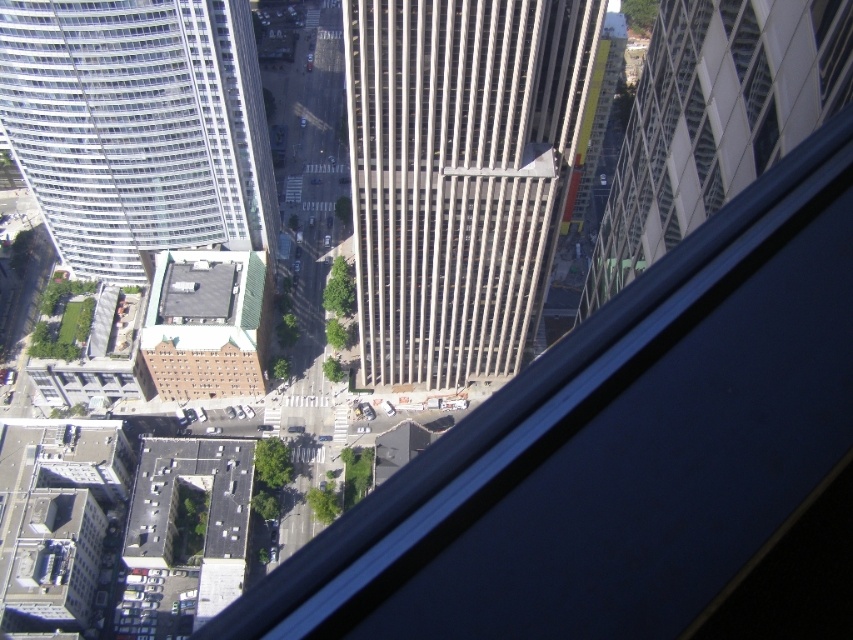
Does gray concrete skyscraper at center have a lesser width compared to white glass building at upper left?

Indeed, gray concrete skyscraper at center has a lesser width compared to white glass building at upper left.

What do you see at coordinates (459, 176) in the screenshot? The width and height of the screenshot is (853, 640). I see `gray concrete skyscraper at center` at bounding box center [459, 176].

Does point (581, 20) lie behind point (268, 177)?

No, it is not.

Find the location of a particular element. The height and width of the screenshot is (640, 853). gray concrete skyscraper at center is located at coordinates click(459, 176).